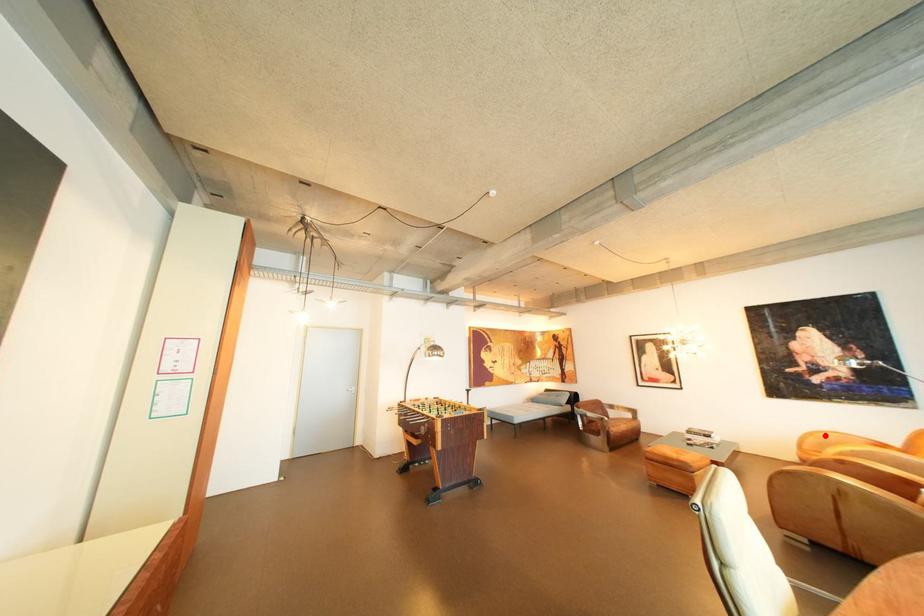
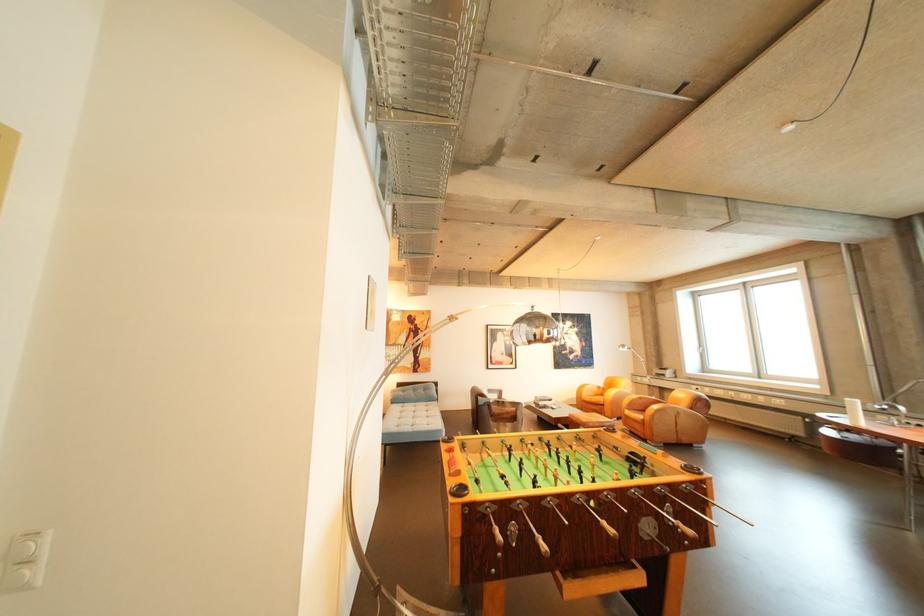
Question: I am providing you with two images of the same scene from different viewpoints. A red point is shown in image1. For the corresponding object point in image2, is it positioned nearer or farther from the camera?

Choices:
 (A) Nearer
 (B) Farther

Answer: (B)